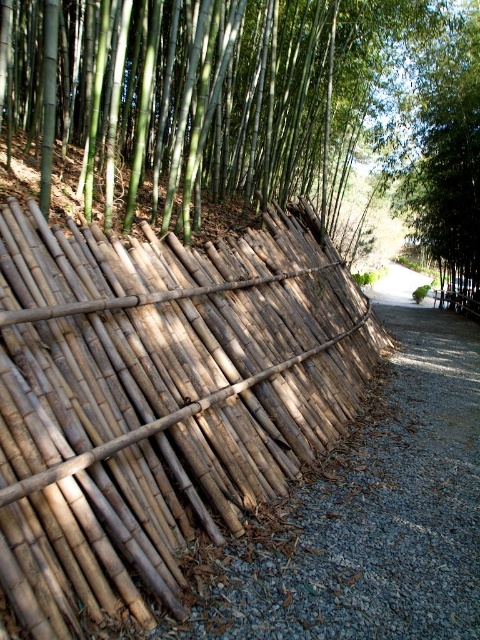
You are standing in the bamboo grove and see a point marked at coordinates [158,397]. Based on the scene description, what object does this point most likely belong to?

The point at coordinates [158,397] corresponds to the natural bamboo fence at left.

You are standing at the entrance of the bamboo grove and want to walk towards the green leafy tree at upper right. There is a natural bamboo fence at left blocking your path. Can you walk around the fence to reach the tree?

The natural bamboo fence at left is 101.05 feet away from the green leafy tree at upper right, so yes, you can walk around the fence to reach the tree since the distance between them allows for a path.